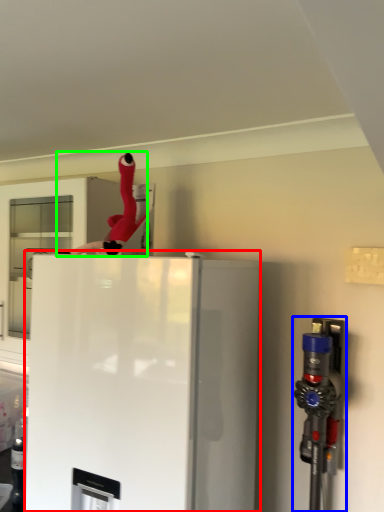
Question: Based on their relative distances, which object is nearer to refrigerator (highlighted by a red box)? Choose from appliance (highlighted by a blue box) and person (highlighted by a green box).

Choices:
 (A) appliance
 (B) person

Answer: (A)